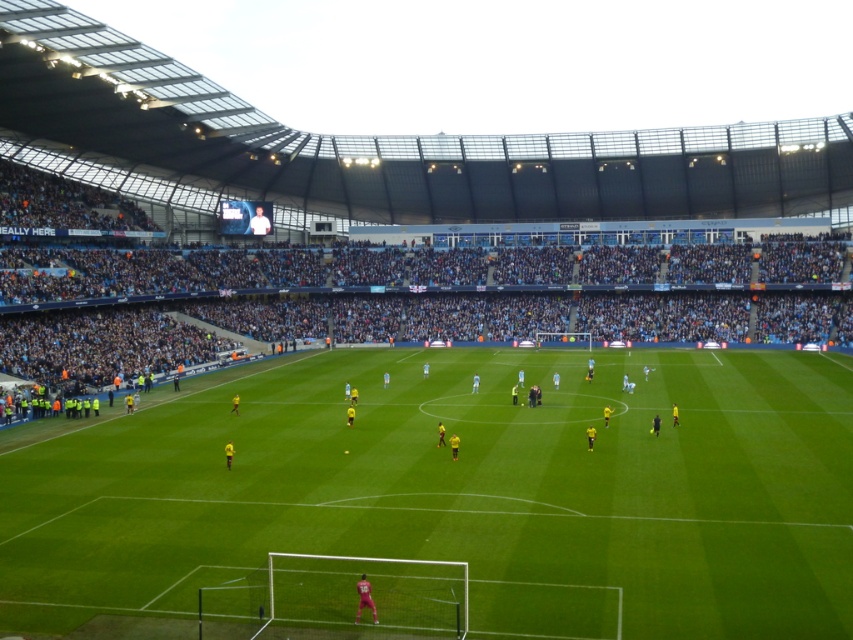
Question: Among these points, which one is nearest to the camera?

Choices:
 (A) (775, 278)
 (B) (115, 476)

Answer: (B)

Question: Can you confirm if green grass football field at center is positioned to the left of light blue jersey at center?

Choices:
 (A) no
 (B) yes

Answer: (A)

Question: Does green grass football field at center have a larger size compared to light blue jersey at center?

Choices:
 (A) yes
 (B) no

Answer: (B)

Question: Is green grass football field at center positioned behind light blue jersey at center?

Choices:
 (A) yes
 (B) no

Answer: (B)